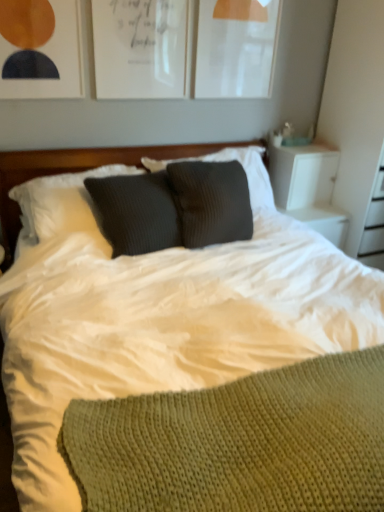
Question: Considering the relative sizes of woolen dark gray pillow at center and white soft bedding at center in the image provided, is woolen dark gray pillow at center wider than white soft bedding at center?

Choices:
 (A) no
 (B) yes

Answer: (A)

Question: Does woolen dark gray pillow at center have a larger size compared to white soft bedding at center?

Choices:
 (A) yes
 (B) no

Answer: (B)

Question: From a real-world perspective, is woolen dark gray pillow at center below white soft bedding at center?

Choices:
 (A) no
 (B) yes

Answer: (A)

Question: Is woolen dark gray pillow at center located outside white soft bedding at center?

Choices:
 (A) no
 (B) yes

Answer: (A)

Question: From the image's perspective, is woolen dark gray pillow at center beneath white soft bedding at center?

Choices:
 (A) yes
 (B) no

Answer: (B)

Question: From a real-world perspective, is matte white picture frame at upper left, which is the 1th picture frame in left-to-right order, positioned above or below white soft bedding at center?

Choices:
 (A) above
 (B) below

Answer: (A)

Question: In terms of width, does matte white picture frame at upper left, which is the 1th picture frame in left-to-right order, look wider or thinner when compared to white soft bedding at center?

Choices:
 (A) thin
 (B) wide

Answer: (A)

Question: Does point (59, 96) appear closer or farther from the camera than point (339, 293)?

Choices:
 (A) farther
 (B) closer

Answer: (A)

Question: Considering the positions of matte white picture frame at upper left, which is the 1th picture frame in left-to-right order, and white soft bedding at center in the image, is matte white picture frame at upper left, which is the 1th picture frame in left-to-right order, taller or shorter than white soft bedding at center?

Choices:
 (A) short
 (B) tall

Answer: (A)

Question: From the image's perspective, relative to white paper at upper center, placed as the 2th picture frame when sorted from right to left, is woolen dark gray pillow at center above or below?

Choices:
 (A) above
 (B) below

Answer: (B)

Question: Based on their sizes in the image, would you say woolen dark gray pillow at center is bigger or smaller than white paper at upper center, placed as the 2th picture frame when sorted from right to left?

Choices:
 (A) small
 (B) big

Answer: (B)

Question: In terms of width, does woolen dark gray pillow at center look wider or thinner when compared to white paper at upper center, which is the 2th picture frame in left-to-right order?

Choices:
 (A) wide
 (B) thin

Answer: (A)

Question: In the image, is woolen dark gray pillow at center positioned in front of or behind white paper at upper center, placed as the 2th picture frame when sorted from right to left?

Choices:
 (A) behind
 (B) front

Answer: (B)

Question: Visually, is white soft bedding at center positioned to the left or to the right of white paper at upper center, which is the 2th picture frame in left-to-right order?

Choices:
 (A) left
 (B) right

Answer: (B)

Question: In the image, is white soft bedding at center positioned in front of or behind white paper at upper center, which is the 2th picture frame in left-to-right order?

Choices:
 (A) behind
 (B) front

Answer: (B)